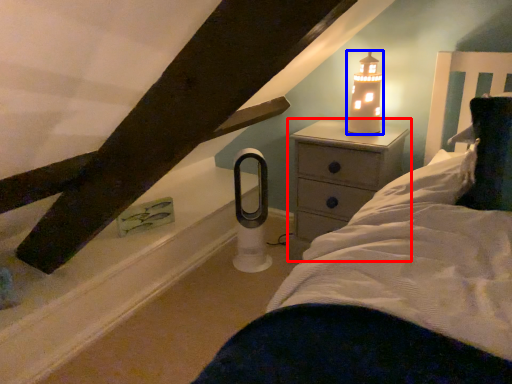
Question: Among these objects, which one is nearest to the camera, nightstand (highlighted by a red box) or candle holder (highlighted by a blue box)?

Choices:
 (A) nightstand
 (B) candle holder

Answer: (A)